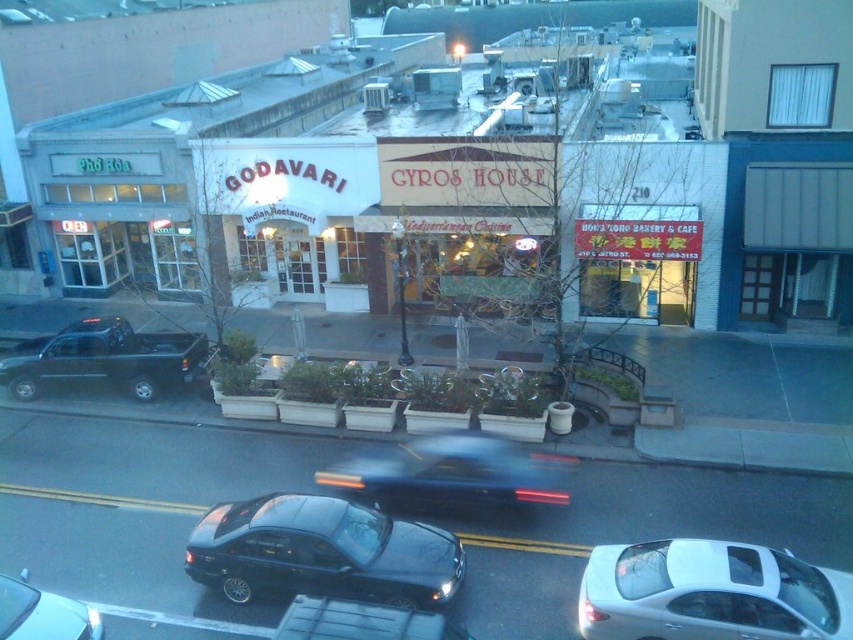
Question: Observing the image, what is the correct spatial positioning of white glossy sedan at center in reference to shiny black sedan at lower left?

Choices:
 (A) below
 (B) above

Answer: (B)

Question: Can you confirm if shiny black sedan at center is bigger than black matte truck at left?

Choices:
 (A) yes
 (B) no

Answer: (B)

Question: Which point appears closest to the camera in this image?

Choices:
 (A) (364, 472)
 (B) (18, 352)
 (C) (276, 637)
 (D) (693, 582)

Answer: (C)

Question: Is white glossy sedan at center thinner than shiny black sedan at lower left?

Choices:
 (A) yes
 (B) no

Answer: (B)

Question: Which point is closer to the camera?

Choices:
 (A) (750, 572)
 (B) (305, 596)

Answer: (B)

Question: Which point is farther to the camera?

Choices:
 (A) (543, 484)
 (B) (225, 541)
 (C) (33, 588)

Answer: (A)